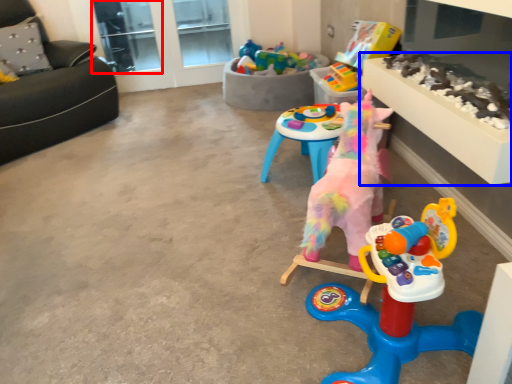
Question: Which of the following is the farthest to the observer, glass door (highlighted by a red box) or table (highlighted by a blue box)?

Choices:
 (A) glass door
 (B) table

Answer: (A)